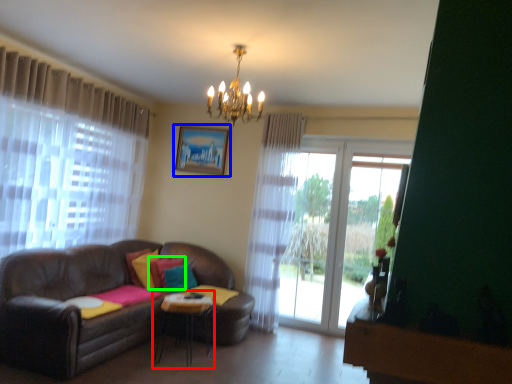
Question: Which is nearer to the table (highlighted by a red box)? picture frame (highlighted by a blue box) or pillow (highlighted by a green box).

Choices:
 (A) picture frame
 (B) pillow

Answer: (B)